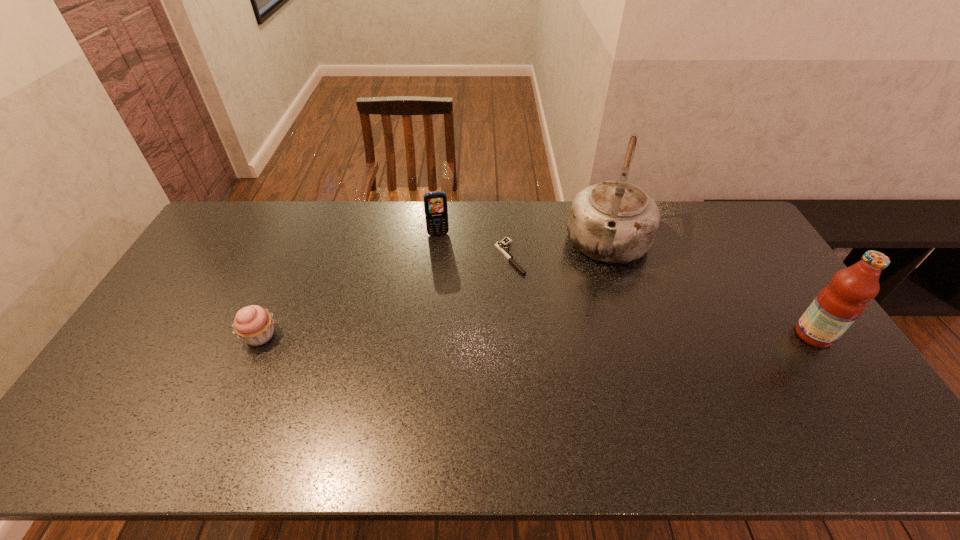
Identify the location of empty space between the shortest object and the fourth shortest object. This screenshot has width=960, height=540. (661, 296).

Locate an element on the screen. free space between the shortest object and the cellular telephone is located at coordinates (474, 246).

What are the coordinates of `blank region between the fruit juice and the leftmost object` in the screenshot? It's located at (537, 335).

Where is `free point between the leftmost object and the rightmost object`? This screenshot has height=540, width=960. free point between the leftmost object and the rightmost object is located at coordinates (537, 335).

Find the location of a particular element. This screenshot has width=960, height=540. free spot between the leftmost object and the second tallest object is located at coordinates (537, 335).

Locate an element on the screen. vacant area between the third object from right to left and the third shortest object is located at coordinates (474, 246).

Locate an element on the screen. This screenshot has width=960, height=540. empty location between the tallest object and the shortest object is located at coordinates (560, 252).

The height and width of the screenshot is (540, 960). I want to click on free space between the fourth object from left to right and the leftmost object, so click(x=435, y=291).

Locate which object ranks second in proximity to the third tallest object. Please provide its 2D coordinates. Your answer should be formatted as a tuple, i.e. [(x, y)], where the tuple contains the x and y coordinates of a point satisfying the conditions above.

[(614, 221)]

Locate which object ranks in proximity to the fruit juice. Please provide its 2D coordinates. Your answer should be formatted as a tuple, i.e. [(x, y)], where the tuple contains the x and y coordinates of a point satisfying the conditions above.

[(614, 221)]